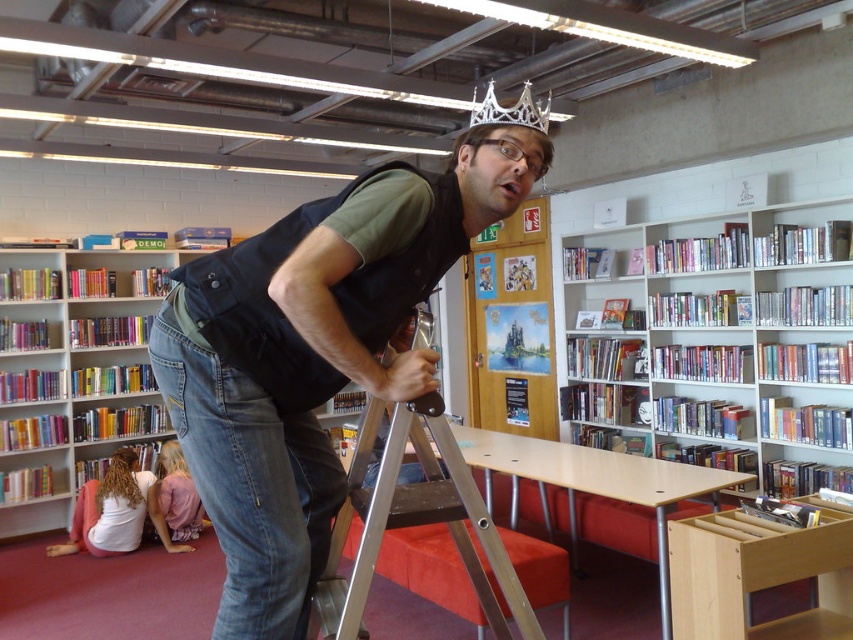
Question: Can you confirm if silver metallic crown at center is wider than silver metallic crown at upper center?

Choices:
 (A) no
 (B) yes

Answer: (A)

Question: Where is matte black vest at center located in relation to multicolored plastic bookcase at lower left in the image?

Choices:
 (A) above
 (B) below

Answer: (A)

Question: Which of these objects is positioned farthest from the silver metallic crown at center?

Choices:
 (A) multicolored plastic bookcase at lower left
 (B) matte black vest at center
 (C) silver metallic ladder at center

Answer: (A)

Question: Which of these objects is positioned farthest from the silver metallic crown at upper center?

Choices:
 (A) matte black vest at center
 (B) silver metallic crown at center
 (C) white glossy bookcase at upper center
 (D) multicolored plastic bookcase at lower left

Answer: (D)

Question: Which of the following is the farthest from the observer?

Choices:
 (A) (508, 118)
 (B) (189, 355)

Answer: (A)

Question: Considering the relative positions of matte black vest at center and white glossy bookcase at upper center in the image provided, where is matte black vest at center located with respect to white glossy bookcase at upper center?

Choices:
 (A) left
 (B) right

Answer: (A)